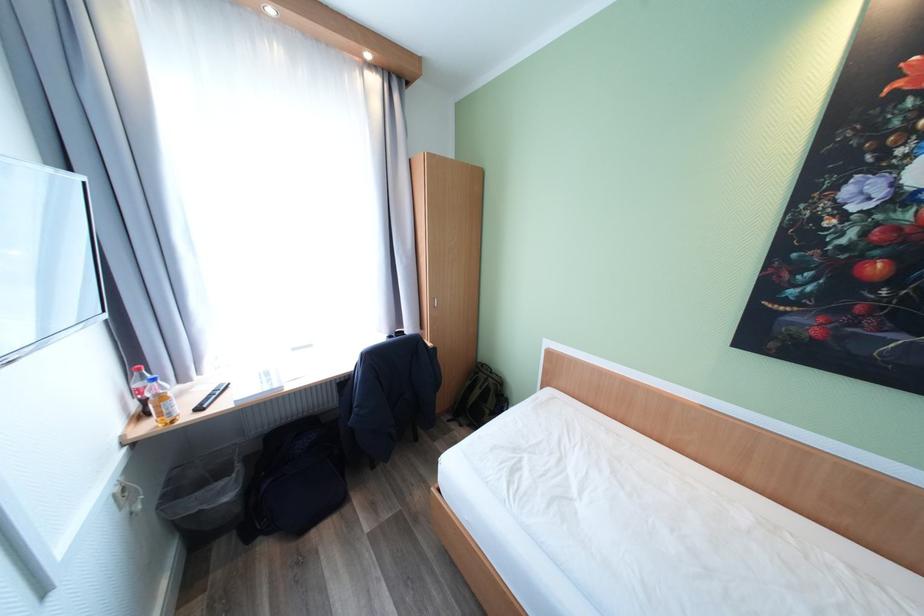
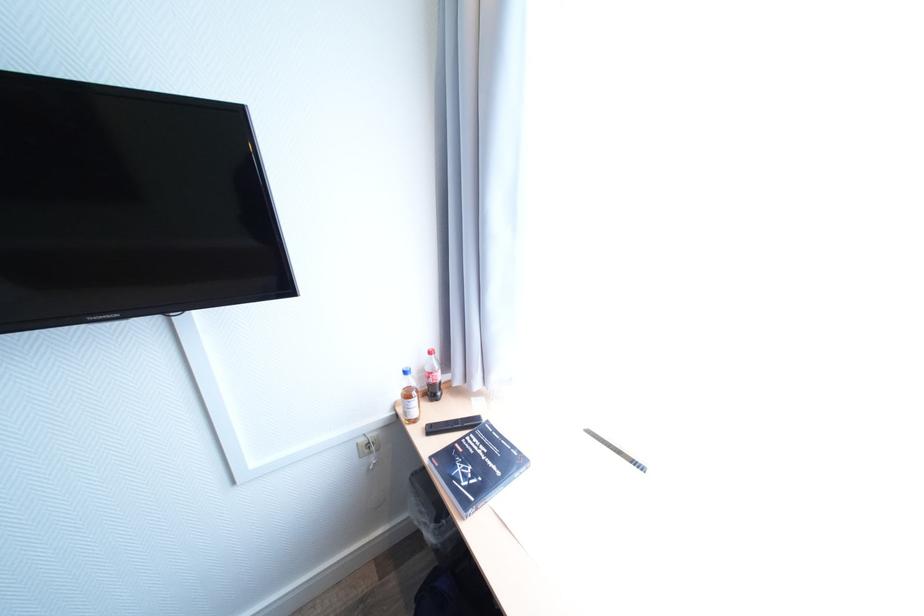
Locate, in the second image, the point that corresponds to [122,496] in the first image.

(365, 445)